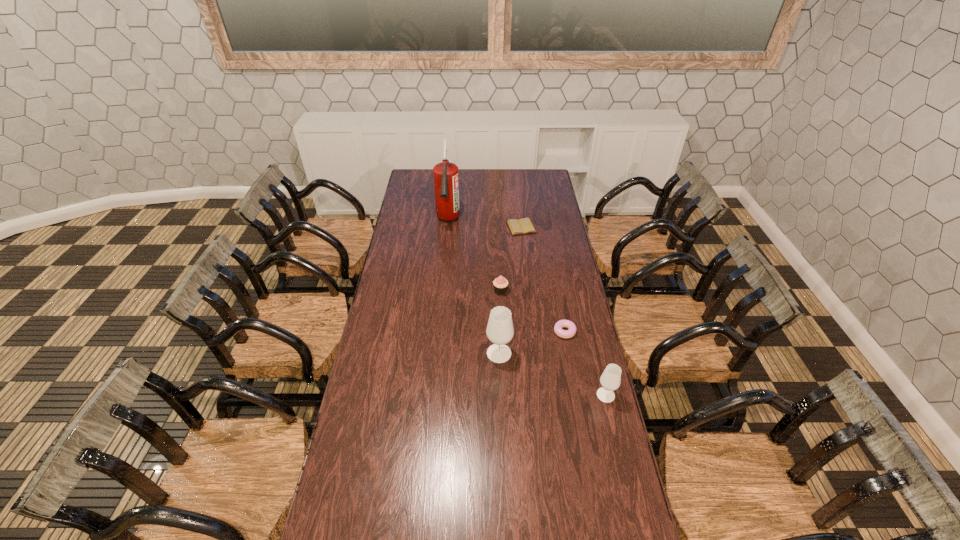
Identify the location of the farther glass. This screenshot has width=960, height=540. (500, 331).

Locate an element on the screen. Image resolution: width=960 pixels, height=540 pixels. the second tallest object is located at coordinates (500, 331).

Identify the location of the shorter glass. This screenshot has height=540, width=960. (610, 380).

Where is `the nearer glass`? This screenshot has width=960, height=540. the nearer glass is located at coordinates (610, 380).

The height and width of the screenshot is (540, 960). I want to click on the tallest object, so click(445, 174).

You are a GUI agent. You are given a task and a screenshot of the screen. Output one action in this format:
    pyautogui.click(x=<x>, y=<y>)
    Task: Click on the leftmost object
    The height and width of the screenshot is (540, 960).
    Given the screenshot: What is the action you would take?
    pyautogui.click(x=445, y=174)

The height and width of the screenshot is (540, 960). Identify the location of the third farthest object. (500, 284).

Where is `cupcake`? The image size is (960, 540). cupcake is located at coordinates (500, 284).

Where is `diary`? diary is located at coordinates (523, 226).

The image size is (960, 540). In order to click on the third object from right to left in this screenshot , I will do `click(523, 226)`.